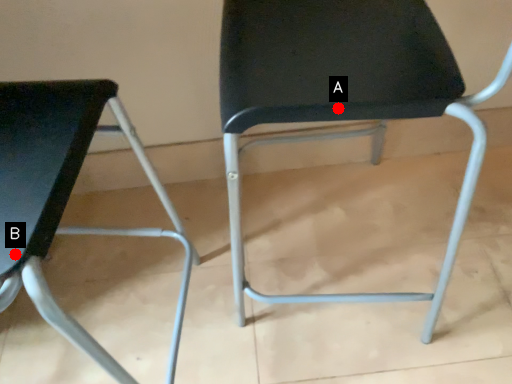
Question: Two points are circled on the image, labeled by A and B beside each circle. Which point is closer to the camera?

Choices:
 (A) A is closer
 (B) B is closer

Answer: (B)